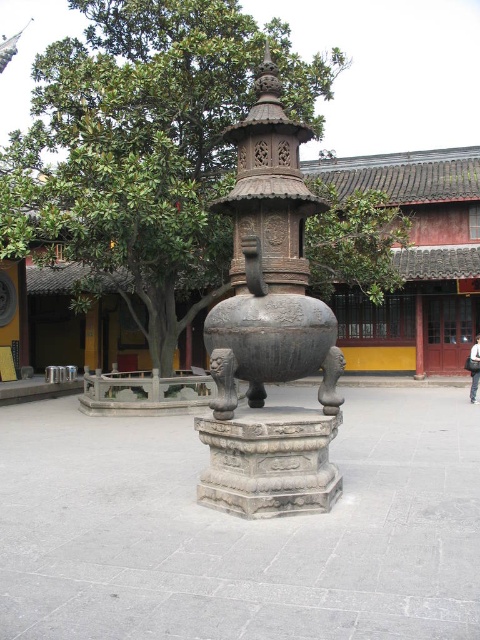
Question: Which point is closer to the camera taking this photo?

Choices:
 (A) (248, 236)
 (B) (288, 51)
 (C) (302, 340)

Answer: (A)

Question: Can you confirm if dark gray stone incense burner at center is wider than polished bronze incense burner at center?

Choices:
 (A) no
 (B) yes

Answer: (B)

Question: Does green leafy tree at center have a lesser width compared to dark gray stone incense burner at center?

Choices:
 (A) yes
 (B) no

Answer: (B)

Question: Which point is farther to the camera?

Choices:
 (A) (272, 202)
 (B) (67, 44)

Answer: (B)

Question: Which point is farther to the camera?

Choices:
 (A) dark gray stone incense burner at center
 (B) green leafy tree at center

Answer: (B)

Question: Considering the relative positions of green leafy tree at center and dark gray stone incense burner at center in the image provided, where is green leafy tree at center located with respect to dark gray stone incense burner at center?

Choices:
 (A) below
 (B) above

Answer: (B)